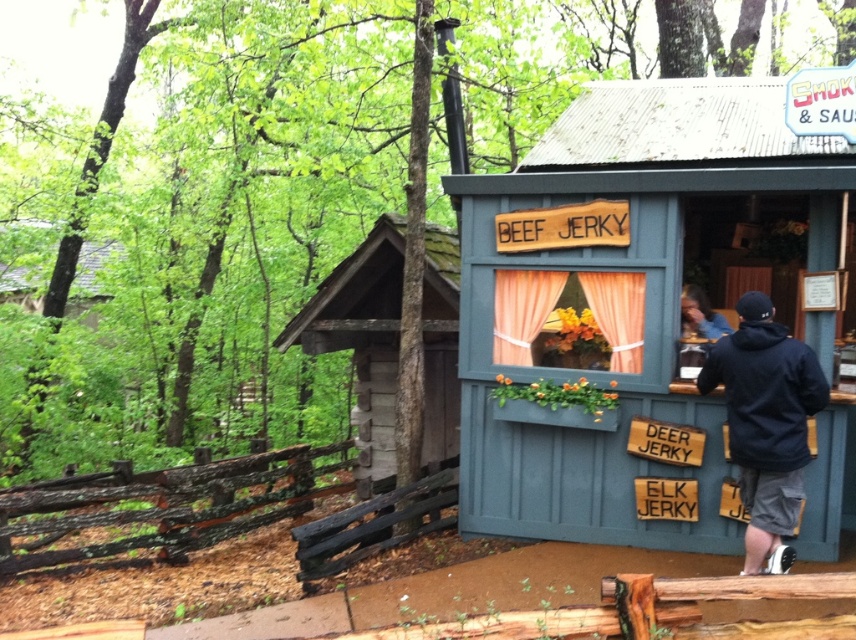
Question: Which object appears farthest from the camera in this image?

Choices:
 (A) black fabric jacket at right
 (B) rustic wood cabin at left
 (C) teal wooden cabin at center

Answer: (B)

Question: Which of these objects is positioned farthest from the black fabric jacket at right?

Choices:
 (A) rustic wood cabin at left
 (B) teal wooden cabin at center

Answer: (A)

Question: Can you confirm if teal wooden cabin at center is positioned above black fabric jacket at right?

Choices:
 (A) no
 (B) yes

Answer: (B)

Question: In this image, where is teal wooden cabin at center located relative to black fabric jacket at right?

Choices:
 (A) right
 (B) left

Answer: (B)

Question: Does teal wooden cabin at center appear under rustic wood cabin at left?

Choices:
 (A) yes
 (B) no

Answer: (B)

Question: Which point is closer to the camera?

Choices:
 (A) (687, 193)
 (B) (771, 388)
 (C) (384, 380)

Answer: (B)